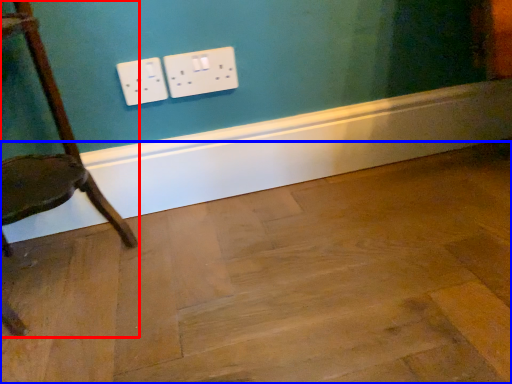
Question: Among these objects, which one is farthest to the camera, chair (highlighted by a red box) or plywood (highlighted by a blue box)?

Choices:
 (A) chair
 (B) plywood

Answer: (A)